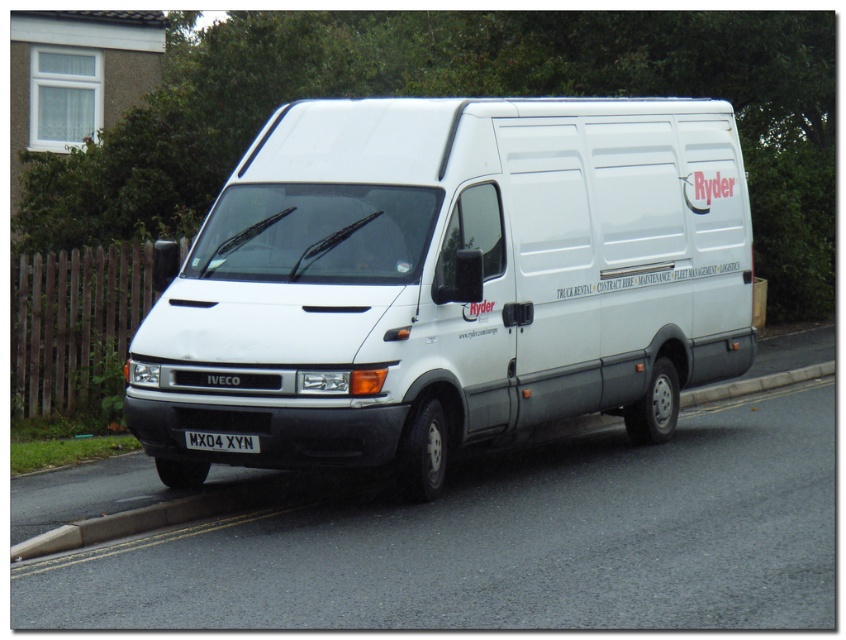
Question: Which point appears closest to the camera in this image?

Choices:
 (A) (273, 499)
 (B) (279, 218)
 (C) (210, 445)

Answer: (C)

Question: Is white matte van at center in front of white plastic license plate at center?

Choices:
 (A) no
 (B) yes

Answer: (A)

Question: Does concrete curb at lower center lie in front of white plastic license plate at center?

Choices:
 (A) no
 (B) yes

Answer: (B)

Question: Which is farther from the white plastic license plate at center?

Choices:
 (A) concrete curb at lower center
 (B) white matte van at center

Answer: (B)

Question: Which of these objects is positioned closest to the concrete curb at lower center?

Choices:
 (A) white plastic license plate at center
 (B) white matte van at center

Answer: (A)

Question: Considering the relative positions of white matte van at center and concrete curb at lower center in the image provided, where is white matte van at center located with respect to concrete curb at lower center?

Choices:
 (A) above
 (B) below

Answer: (A)